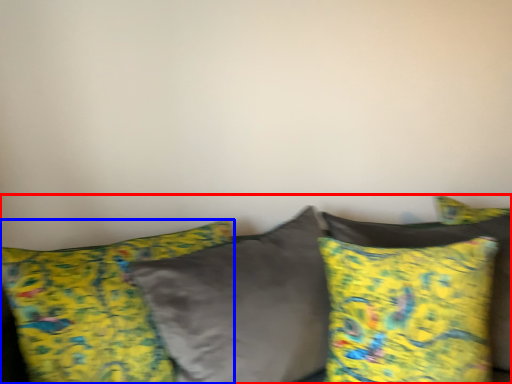
Question: Which of the following is the farthest to the observer, studio couch (highlighted by a red box) or pillow (highlighted by a blue box)?

Choices:
 (A) studio couch
 (B) pillow

Answer: (B)